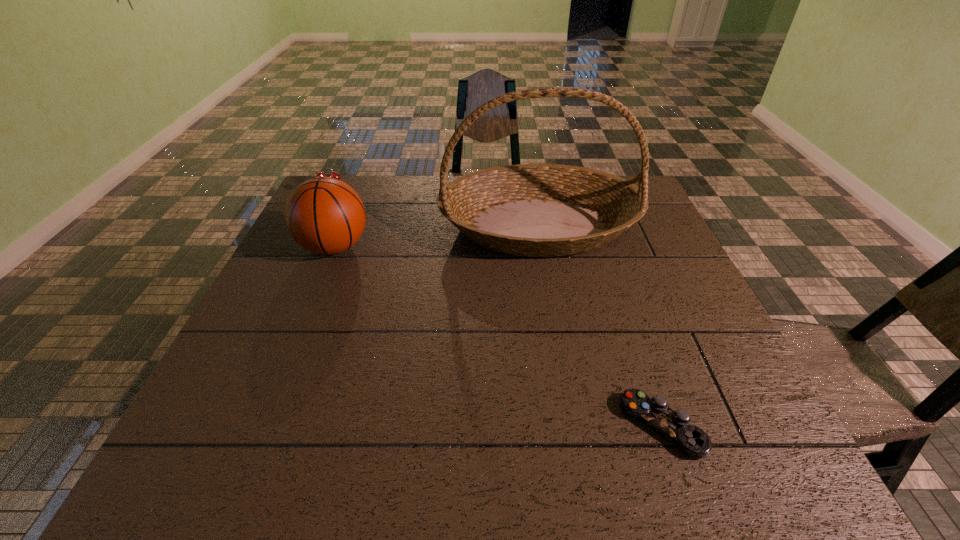
This screenshot has height=540, width=960. In order to click on the tallest object in this screenshot , I will do `click(535, 210)`.

Find the location of `the third shortest object`. the third shortest object is located at coordinates (x=324, y=215).

The width and height of the screenshot is (960, 540). In order to click on alarm clock in this screenshot , I will do `click(336, 175)`.

Find the location of a particular element. The height and width of the screenshot is (540, 960). the shortest object is located at coordinates tap(674, 425).

I want to click on the nearest object, so click(x=674, y=425).

You are a GUI agent. You are given a task and a screenshot of the screen. Output one action in this format:
    pyautogui.click(x=<x>, y=<y>)
    Task: Click on the free space located on the left of the basket
    The width and height of the screenshot is (960, 540).
    Given the screenshot: What is the action you would take?
    pyautogui.click(x=376, y=226)

Identify the location of vacant area located 0.100m on the back of the third shortest object. (350, 208).

The height and width of the screenshot is (540, 960). Find the location of `vacant area situated 0.210m on the face of the alarm clock`. vacant area situated 0.210m on the face of the alarm clock is located at coordinates (x=313, y=238).

This screenshot has height=540, width=960. In order to click on vacant space located 0.050m on the right of the control in this screenshot , I will do `click(727, 426)`.

Image resolution: width=960 pixels, height=540 pixels. What are the coordinates of `basket present at the far edge` in the screenshot? It's located at (535, 210).